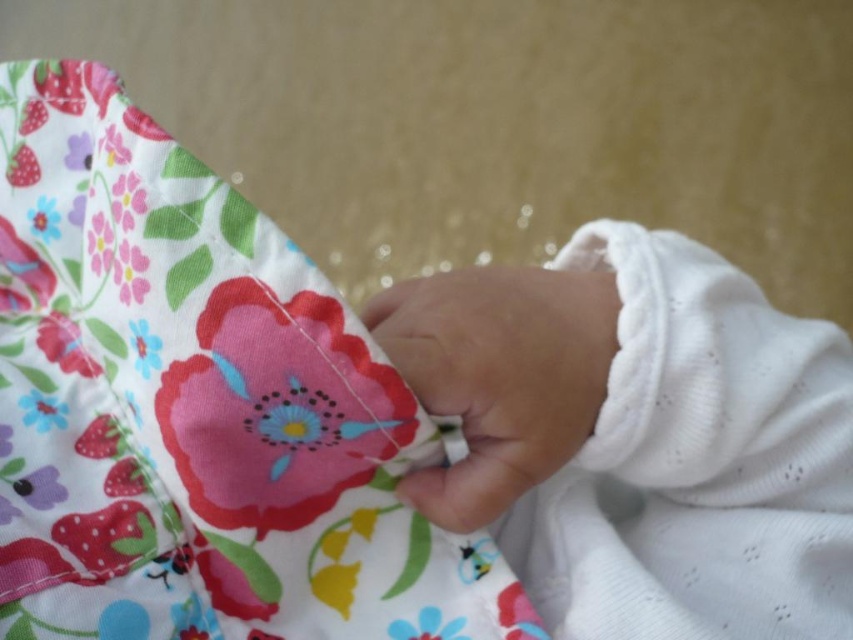
You are a parent trying to choose between two fabrics for a baby blanket. The floral fabric at center has a quilted texture and vibrant colors, while the white soft fabric at center is plain and smooth. Based on the image, which fabric do you think is wider?

The floral fabric at center is wider than the white soft fabric at center according to the description.

You are a parent trying to cover your baby with a blanket. The blanket has a white soft fabric at center and a smooth white hand at center. Which one should you use to cover the baby?

The white soft fabric at center is larger in size than the smooth white hand at center, so you should use the white soft fabric at center to cover the baby since it is bigger and more suitable for covering.